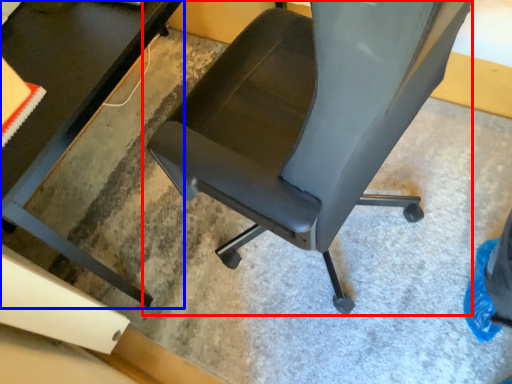
Question: Which point is further to the camera, chair (highlighted by a red box) or table (highlighted by a blue box)?

Choices:
 (A) chair
 (B) table

Answer: (B)